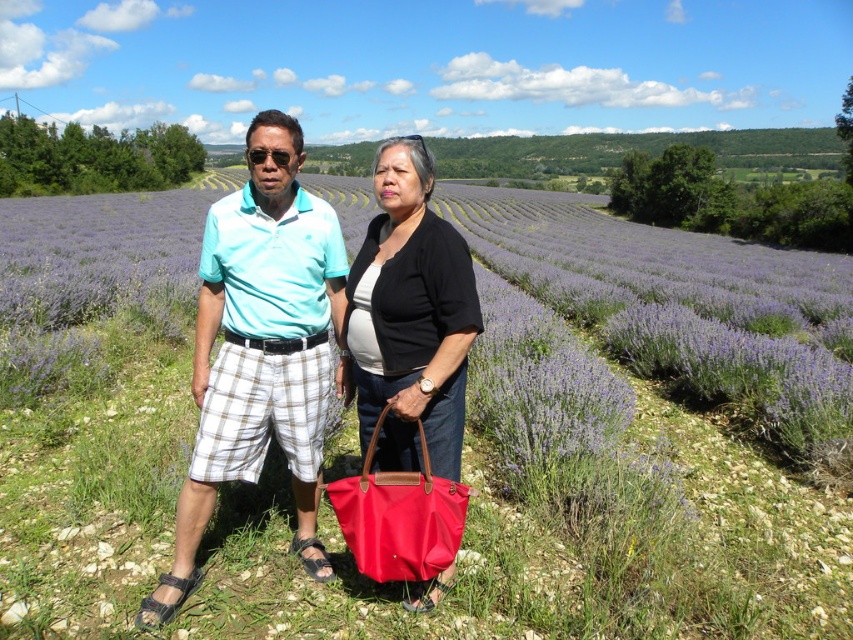
Question: Is purple lavender field at center below matte black shirt at center?

Choices:
 (A) no
 (B) yes

Answer: (A)

Question: Is light blue cotton polo shirt at center above matte black shirt at center?

Choices:
 (A) yes
 (B) no

Answer: (A)

Question: From the image, what is the correct spatial relationship of purple lavender field at center in relation to red nylon tote at center?

Choices:
 (A) above
 (B) below

Answer: (A)

Question: Which point is farther to the camera?

Choices:
 (A) (212, 406)
 (B) (350, 266)
 (C) (354, 497)

Answer: (B)

Question: Which object is the farthest from the purple lavender field at center?

Choices:
 (A) red nylon tote at center
 (B) matte black shirt at center
 (C) light blue cotton polo shirt at center

Answer: (C)

Question: Considering the real-world distances, which object is farthest from the matte black shirt at center?

Choices:
 (A) light blue cotton polo shirt at center
 (B) purple lavender field at center

Answer: (B)